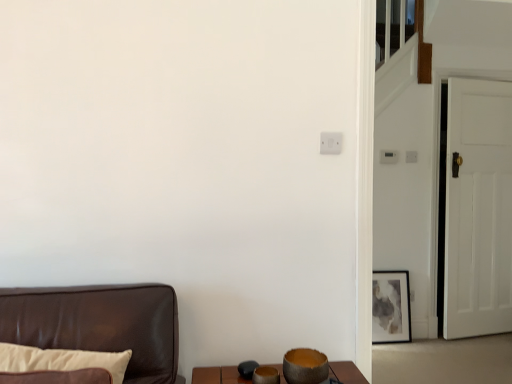
Measure the distance between matte gray painting at right and camera.

The distance of matte gray painting at right from camera is 10.39 feet.

At what (x,y) coordinates should I click in order to perform the action: click on white wooden door at right. Please return your answer as a coordinate pair (x, y). This screenshot has width=512, height=384. Looking at the image, I should click on (478, 209).

I want to click on white plastic light switch at upper right, so click(388, 157).

Is matte gray painting at right smaller than white plastic light switch at upper right?

Incorrect, matte gray painting at right is not smaller in size than white plastic light switch at upper right.

From a real-world perspective, relative to white plastic light switch at upper right, is matte gray painting at right vertically above or below?

Clearly, from a real-world perspective, matte gray painting at right is below white plastic light switch at upper right.

Considering the sizes of objects matte gray painting at right and white plastic light switch at upper right in the image provided, who is shorter, matte gray painting at right or white plastic light switch at upper right?

Standing shorter between the two is white plastic light switch at upper right.

Is white plastic light switch at upper right completely or partially inside matte gray painting at right?

No, white plastic light switch at upper right is not surrounded by matte gray painting at right.

Can you tell me how much white plastic light switch at upper right and matte gray painting at right differ in facing direction?

The facing directions of white plastic light switch at upper right and matte gray painting at right are 1.26 degrees apart.

Considering the relative positions of white plastic light switch at upper right and matte gray painting at right in the image provided, is white plastic light switch at upper right to the right of matte gray painting at right from the viewer's perspective?

In fact, white plastic light switch at upper right is to the left of matte gray painting at right.

From the image's perspective, which one is positioned higher, white plastic light switch at upper right or matte gray painting at right?

white plastic light switch at upper right.

Considering the points (394, 153) and (392, 285), which point is behind, point (394, 153) or point (392, 285)?

Point (392, 285)

Is white wooden door at right next to white plastic light switch at upper right and touching it?

No, white wooden door at right is not making contact with white plastic light switch at upper right.

Which object is closer to the camera, white wooden door at right or white plastic light switch at upper right?

white wooden door at right is more forward.

Consider the image. Which object is positioned more to the left, white wooden door at right or white plastic light switch at upper right?

Positioned to the left is white plastic light switch at upper right.

Is white wooden door at right aimed at white plastic light switch at upper right?

No, white wooden door at right is not oriented towards white plastic light switch at upper right.

Which object is wider, matte gray painting at right or white wooden door at right?

white wooden door at right is wider.

Is matte gray painting at right bigger than white wooden door at right?

Incorrect, matte gray painting at right is not larger than white wooden door at right.

Between matte gray painting at right and white wooden door at right, which one appears on the right side from the viewer's perspective?

white wooden door at right.

Is white wooden door at right bigger than matte gray painting at right?

Correct, white wooden door at right is larger in size than matte gray painting at right.

From a real-world perspective, does white wooden door at right stand above matte gray painting at right?

Correct, in the physical world, white wooden door at right is higher than matte gray painting at right.

Is white wooden door at right positioned before matte gray painting at right?

Yes, white wooden door at right is closer to the camera.

From the image's perspective, is white plastic light switch at upper right positioned above or below white wooden door at right?

Based on their image positions, white plastic light switch at upper right is located above white wooden door at right.

Considering the sizes of objects white plastic light switch at upper right and white wooden door at right in the image provided, who is smaller, white plastic light switch at upper right or white wooden door at right?

With smaller size is white plastic light switch at upper right.

Considering the positions of objects white plastic light switch at upper right and white wooden door at right in the image provided, who is more to the right, white plastic light switch at upper right or white wooden door at right?

Positioned to the right is white wooden door at right.

This screenshot has height=384, width=512. In order to click on light switch behind the matte gray painting at right in this screenshot , I will do `click(388, 157)`.

Locate an element on the screen. The image size is (512, 384). picture frame located in front of the white plastic light switch at upper right is located at coordinates (391, 307).

Considering their positions, is white wooden door at right positioned further to white plastic light switch at upper right than matte gray painting at right?

Among the two, matte gray painting at right is located further to white plastic light switch at upper right.

Considering their positions, is white wooden door at right positioned further to matte gray painting at right than white plastic light switch at upper right?

white plastic light switch at upper right.

Which object lies nearer to the anchor point white wooden door at right, white plastic light switch at upper right or matte gray painting at right?

The object closer to white wooden door at right is matte gray painting at right.

Based on their spatial positions, is matte gray painting at right or white wooden door at right closer to white plastic light switch at upper right?

white wooden door at right is positioned closer to the anchor white plastic light switch at upper right.

Based on the photo, which object lies further to the anchor point white wooden door at right, matte gray painting at right or white plastic light switch at upper right?

The object further to white wooden door at right is white plastic light switch at upper right.

Which object lies further to the anchor point matte gray painting at right, white plastic light switch at upper right or white wooden door at right?

Based on the image, white plastic light switch at upper right appears to be further to matte gray painting at right.

This screenshot has width=512, height=384. I want to click on door between white plastic light switch at upper right and matte gray painting at right in the up-down direction, so 478,209.